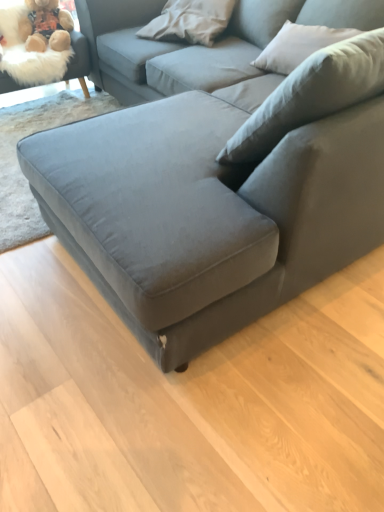
Question: Should I look upward or downward to see fuzzy beige teddy bear at upper left?

Choices:
 (A) up
 (B) down

Answer: (A)

Question: From the image's perspective, is fuzzy beige teddy bear at upper left located beneath velvet gray couch at center?

Choices:
 (A) yes
 (B) no

Answer: (B)

Question: Can you confirm if fuzzy beige teddy bear at upper left is positioned to the right of velvet gray couch at center?

Choices:
 (A) no
 (B) yes

Answer: (A)

Question: Does fuzzy beige teddy bear at upper left turn towards velvet gray couch at center?

Choices:
 (A) yes
 (B) no

Answer: (A)

Question: Is fuzzy beige teddy bear at upper left oriented away from velvet gray couch at center?

Choices:
 (A) yes
 (B) no

Answer: (A)

Question: Is fuzzy beige teddy bear at upper left positioned behind velvet gray couch at center?

Choices:
 (A) no
 (B) yes

Answer: (B)

Question: Can you confirm if fuzzy beige teddy bear at upper left is smaller than velvet gray couch at center?

Choices:
 (A) yes
 (B) no

Answer: (A)

Question: Are velvet gray couch at center and fuzzy beige teddy bear at upper left making contact?

Choices:
 (A) yes
 (B) no

Answer: (B)

Question: Can you confirm if velvet gray couch at center is smaller than fuzzy beige teddy bear at upper left?

Choices:
 (A) yes
 (B) no

Answer: (B)

Question: Can you confirm if velvet gray couch at center is shorter than fuzzy beige teddy bear at upper left?

Choices:
 (A) yes
 (B) no

Answer: (B)

Question: Is fuzzy beige teddy bear at upper left completely or partially inside velvet gray couch at center?

Choices:
 (A) no
 (B) yes

Answer: (B)

Question: Is velvet gray couch at center closer to the viewer compared to fuzzy beige teddy bear at upper left?

Choices:
 (A) yes
 (B) no

Answer: (A)

Question: Is velvet gray couch at center taller than fuzzy beige teddy bear at upper left?

Choices:
 (A) no
 (B) yes

Answer: (B)

Question: From the image's perspective, is velvet gray couch at center on top of fluffy beige swivel chair at upper left?

Choices:
 (A) yes
 (B) no

Answer: (B)